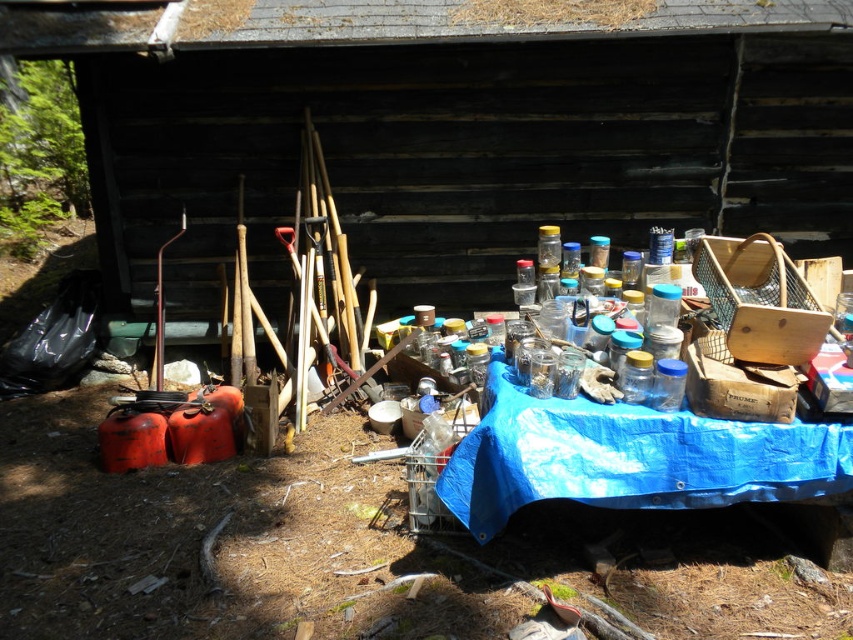
You are a customer at a rustic outdoor market and want to pick up an item from the transparent plastic containers at center. You are currently standing 3 meters away from the blue tarpaulin table at center. Can you reach the containers without moving closer?

The transparent plastic containers at center are 2.60 meters away from the blue tarpaulin table at center. Since you are standing 3 meters away from the table, the total distance to the containers would be 3 meters plus 2.60 meters, totaling 5.60 meters. Therefore, you cannot reach them without moving closer.